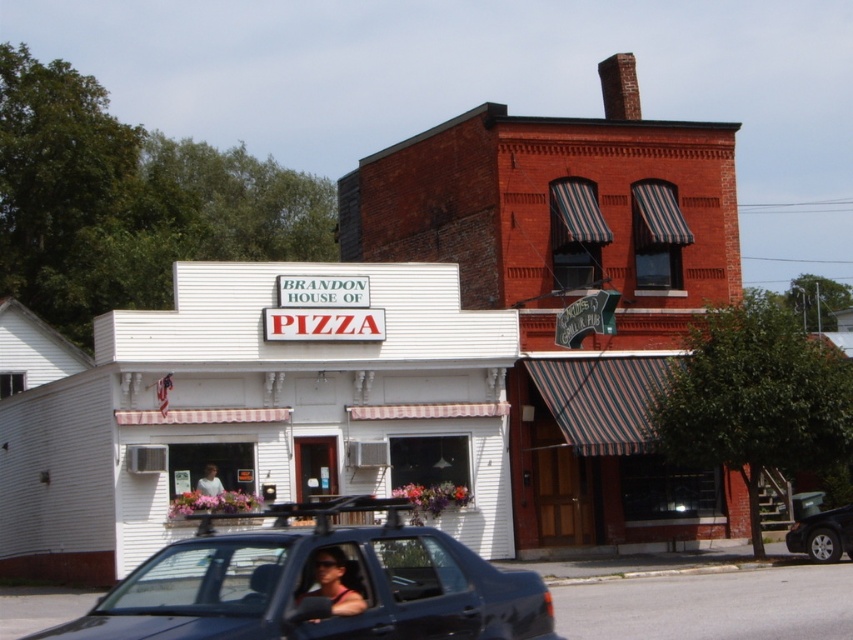
Question: Observing the image, what is the correct spatial positioning of clear glass window at center in reference to black rubber car at lower right?

Choices:
 (A) above
 (B) below

Answer: (A)

Question: Does matte black truck at center appear on the right side of black rubber car at lower right?

Choices:
 (A) no
 (B) yes

Answer: (A)

Question: Estimate the real-world distances between objects in this image. Which object is closer to the matte black truck at center?

Choices:
 (A) black rubber car at lower right
 (B) clear glass window at center

Answer: (B)

Question: Which object is positioned closest to the black rubber car at lower right?

Choices:
 (A) clear glass window at center
 (B) white fabric shirt at center
 (C) white woodshed at center
 (D) transparent glass car window at lower center

Answer: (B)

Question: Is matte black truck at center bigger than transparent plastic window at center?

Choices:
 (A) no
 (B) yes

Answer: (B)

Question: Which point appears farthest from the camera in this image?

Choices:
 (A) (125, 589)
 (B) (206, 483)
 (C) (368, 600)
 (D) (793, 525)

Answer: (D)